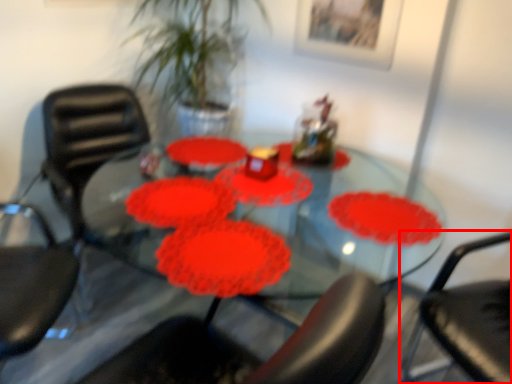
Question: From the image's perspective, where is chair (annotated by the red box) located in relation to chair in the image?

Choices:
 (A) above
 (B) below

Answer: (B)